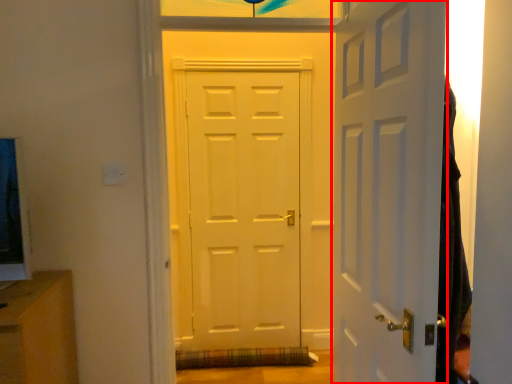
Question: From the image's perspective, where is door (annotated by the red box) located relative to door?

Choices:
 (A) above
 (B) below

Answer: (B)